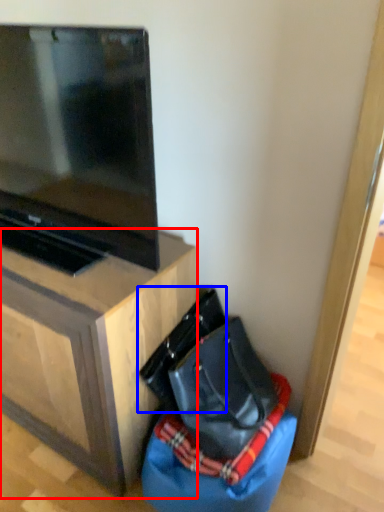
Question: Which object is closer to the camera taking this photo, furniture (highlighted by a red box) or messenger bag (highlighted by a blue box)?

Choices:
 (A) furniture
 (B) messenger bag

Answer: (A)